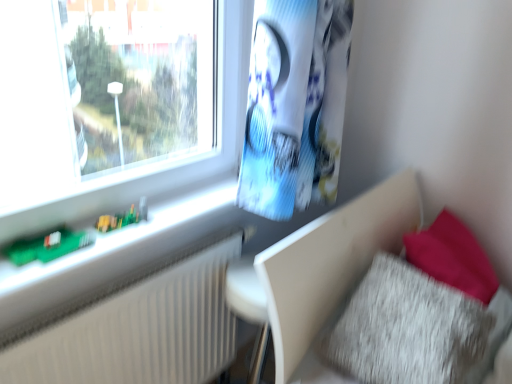
Question: Is fuzzy fabric pillow at lower right positioned beyond the bounds of green plastic toy at lower left?

Choices:
 (A) yes
 (B) no

Answer: (A)

Question: Considering the relative sizes of fuzzy fabric pillow at lower right and green plastic toy at lower left in the image provided, is fuzzy fabric pillow at lower right smaller than green plastic toy at lower left?

Choices:
 (A) yes
 (B) no

Answer: (B)

Question: From a real-world perspective, is fuzzy fabric pillow at lower right on green plastic toy at lower left?

Choices:
 (A) yes
 (B) no

Answer: (B)

Question: Can you confirm if fuzzy fabric pillow at lower right is wider than green plastic toy at lower left?

Choices:
 (A) yes
 (B) no

Answer: (A)

Question: Is fuzzy fabric pillow at lower right looking in the opposite direction of green plastic toy at lower left?

Choices:
 (A) yes
 (B) no

Answer: (A)

Question: Is fuzzy fabric pillow at lower right directly adjacent to green plastic toy at lower left?

Choices:
 (A) yes
 (B) no

Answer: (B)

Question: From a real-world perspective, is fuzzy fabric pillow at lower right positioned over green circuit board at left based on gravity?

Choices:
 (A) no
 (B) yes

Answer: (A)

Question: From the image's perspective, is fuzzy fabric pillow at lower right over green circuit board at left?

Choices:
 (A) yes
 (B) no

Answer: (B)

Question: Is fuzzy fabric pillow at lower right thinner than green circuit board at left?

Choices:
 (A) no
 (B) yes

Answer: (A)

Question: Can you confirm if fuzzy fabric pillow at lower right is wider than green circuit board at left?

Choices:
 (A) no
 (B) yes

Answer: (B)

Question: Is the depth of fuzzy fabric pillow at lower right less than that of green circuit board at left?

Choices:
 (A) no
 (B) yes

Answer: (B)

Question: Is fuzzy fabric pillow at lower right at the left side of green circuit board at left?

Choices:
 (A) no
 (B) yes

Answer: (A)

Question: Is white textured radiator at left far from green circuit board at left?

Choices:
 (A) no
 (B) yes

Answer: (A)